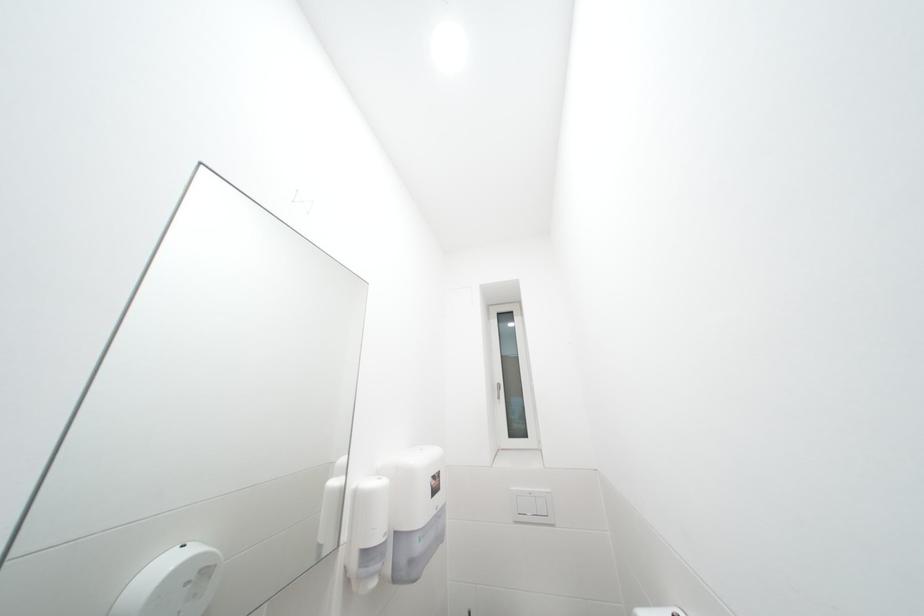
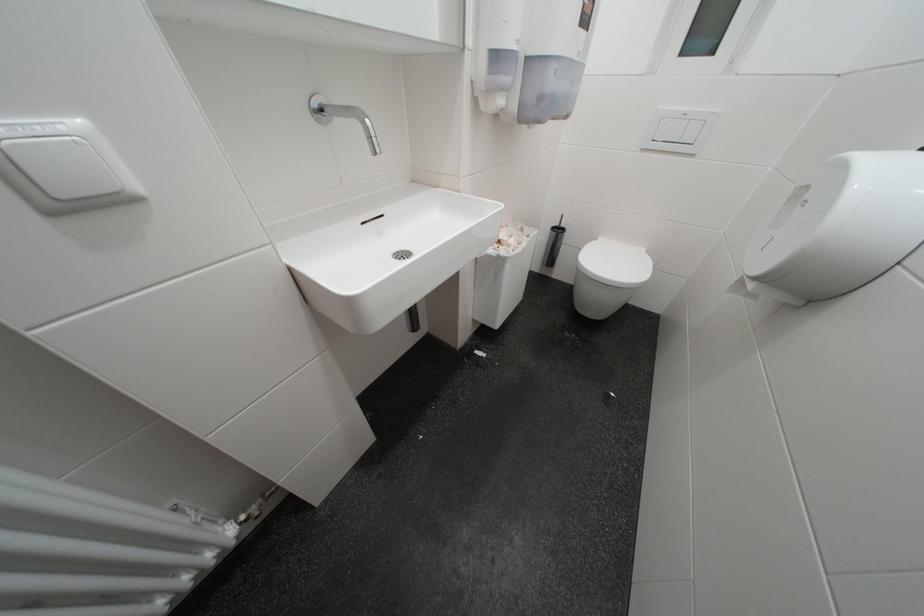
The first image is from the beginning of the video and the second image is from the end. How did the camera likely rotate when shooting the video?

The camera's rotation is toward left-down.